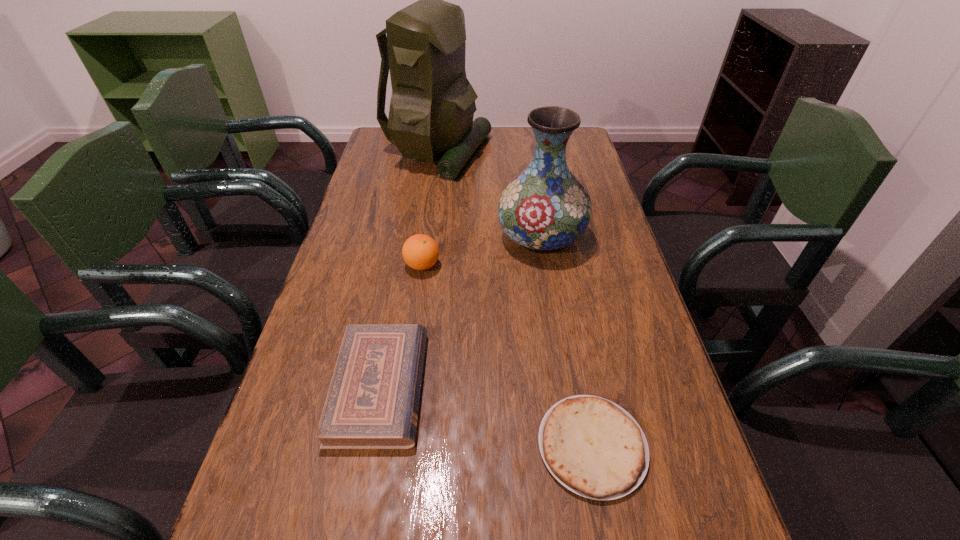
Identify the location of backpack. (432, 106).

This screenshot has height=540, width=960. I want to click on the tallest object, so click(x=432, y=106).

Identify the location of vase. (545, 208).

You are a GUI agent. You are given a task and a screenshot of the screen. Output one action in this format:
    pyautogui.click(x=<x>, y=<y>)
    Task: Click on the orange
    
    Given the screenshot: What is the action you would take?
    pyautogui.click(x=420, y=252)

Locate an element on the screen. the second shortest object is located at coordinates (373, 399).

At what (x,y) coordinates should I click in order to perform the action: click on the shortest object. Please return your answer as a coordinate pair (x, y). Looking at the image, I should click on (593, 447).

The width and height of the screenshot is (960, 540). Find the location of `free space located on the front of the backpack with visible pockets`. free space located on the front of the backpack with visible pockets is located at coordinates (582, 153).

The width and height of the screenshot is (960, 540). What are the coordinates of `vacant space situated on the back of the fourth shortest object` in the screenshot? It's located at (533, 186).

Find the location of `vacant point located on the left of the third tallest object`. vacant point located on the left of the third tallest object is located at coordinates (350, 265).

At what (x,y) coordinates should I click in order to perform the action: click on blank space located on the spine side of the Bible. Please return your answer as a coordinate pair (x, y). This screenshot has height=540, width=960. Looking at the image, I should click on [x=617, y=387].